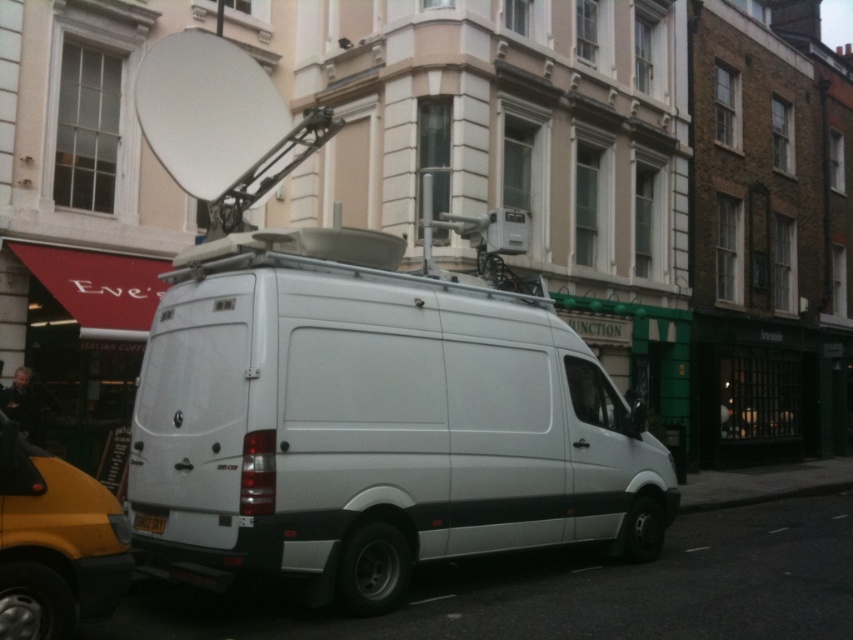
You are standing at the camera position and want to take a photo of the white matte van at center. The van is 17.93 feet away from you. If your camera has a maximum focus range of 15 feet, will you be able to capture a clear photo of the van?

The white matte van at center is 17.93 feet away from the camera, which exceeds the camera maximum focus range of 15 feet. Therefore, the camera cannot capture a clear photo of the van.

You are a delivery driver who needs to attach a GPS tracker to the rear of the white matte van at center. The GPS tracker must be placed exactly 2 meters away from the van. Is the current position of the black plastic license plate at rear suitable for placing the GPS tracker?

The white matte van at center and black plastic license plate at rear are 1.97 meters apart. Since the required distance is 2 meters, the black plastic license plate at rear is slightly too close and not suitable for placing the GPS tracker.

You are standing in front of the Mercedes Benz Sprinter van and want to locate two points marked on the van. The first point is at coordinate point [550,464] and the second is at point [165,516]. Which of these two points is closer to you?

Point [550,464] is closer to you because it is further to the viewer than point [165,516].